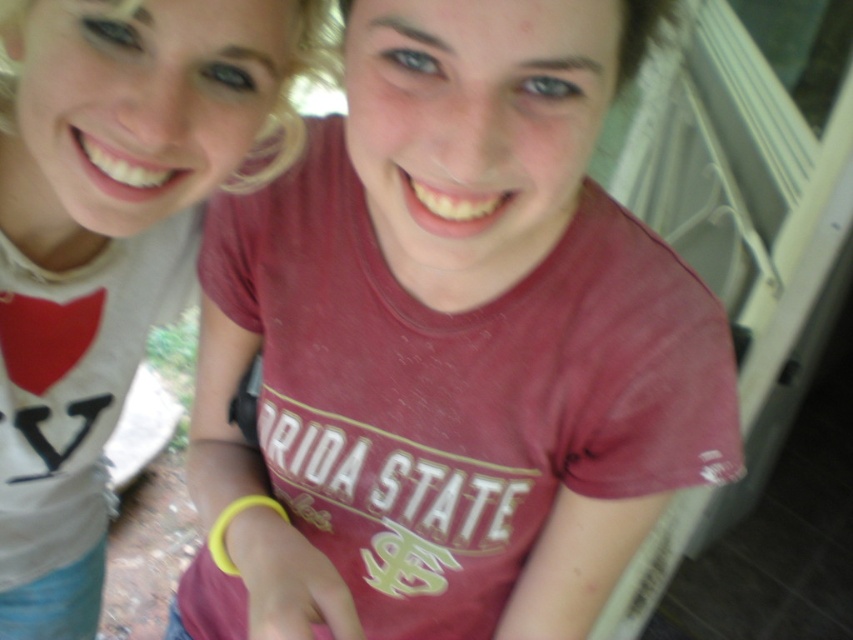
Does maroon cotton t-shirt at center appear on the left side of matte white t-shirt at upper left?

No, maroon cotton t-shirt at center is not to the left of matte white t-shirt at upper left.

Based on the photo, is maroon cotton t-shirt at center shorter than matte white t-shirt at upper left?

Indeed, maroon cotton t-shirt at center has a lesser height compared to matte white t-shirt at upper left.

You are a GUI agent. You are given a task and a screenshot of the screen. Output one action in this format:
    pyautogui.click(x=<x>, y=<y>)
    Task: Click on the maroon cotton t-shirt at center
    Image resolution: width=853 pixels, height=640 pixels.
    Given the screenshot: What is the action you would take?
    pyautogui.click(x=450, y=346)